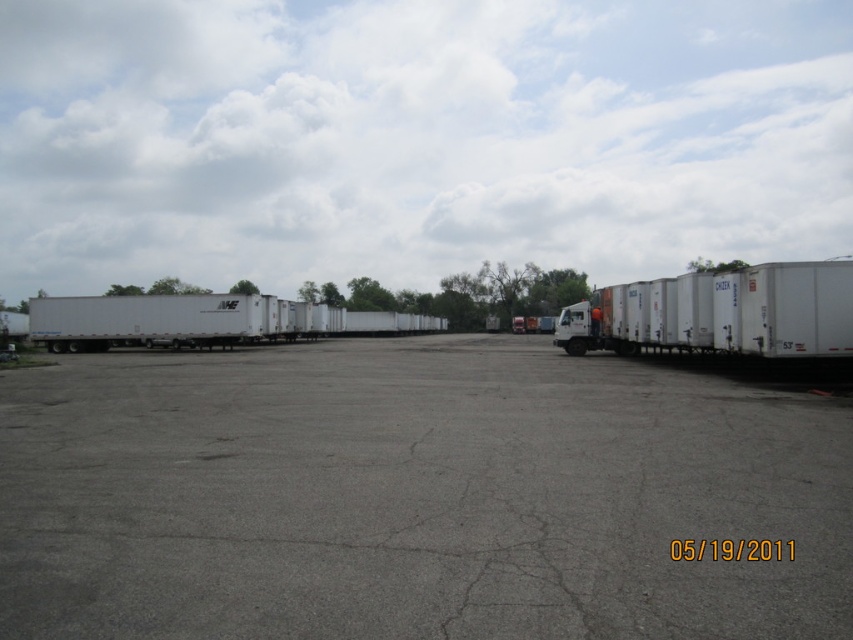
Measure the distance from white matte trailer truck at right to white matte trailer at left.

39.68 meters

Is white matte trailer truck at right smaller than white matte trailer at left?

Yes.

Identify the location of white matte trailer truck at right. The width and height of the screenshot is (853, 640). (720, 312).

Locate an element on the screen. Image resolution: width=853 pixels, height=640 pixels. white matte trailer truck at right is located at coordinates (720, 312).

How much distance is there between gray asphalt parking lot at center and white matte trailer at left?

The distance of gray asphalt parking lot at center from white matte trailer at left is 41.09 meters.

Who is higher up, gray asphalt parking lot at center or white matte trailer at left?

white matte trailer at left is higher up.

The width and height of the screenshot is (853, 640). What do you see at coordinates (415, 497) in the screenshot?
I see `gray asphalt parking lot at center` at bounding box center [415, 497].

The image size is (853, 640). Find the location of `gray asphalt parking lot at center`. gray asphalt parking lot at center is located at coordinates 415,497.

Between gray asphalt parking lot at center and white matte trailer truck at right, which one has more height?

white matte trailer truck at right

Can you confirm if gray asphalt parking lot at center is wider than white matte trailer truck at right?

Result: Indeed, gray asphalt parking lot at center has a greater width compared to white matte trailer truck at right.

Does point (332, 572) lie behind point (840, 333)?

That is False.

You are a GUI agent. You are given a task and a screenshot of the screen. Output one action in this format:
    pyautogui.click(x=<x>, y=<y>)
    Task: Click on the gray asphalt parking lot at center
    The height and width of the screenshot is (640, 853).
    Given the screenshot: What is the action you would take?
    point(415,497)